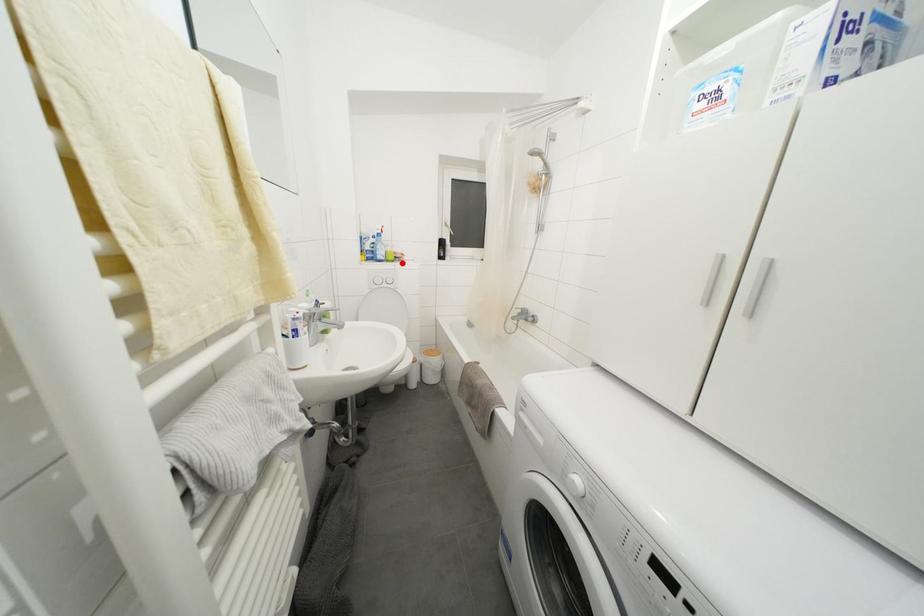
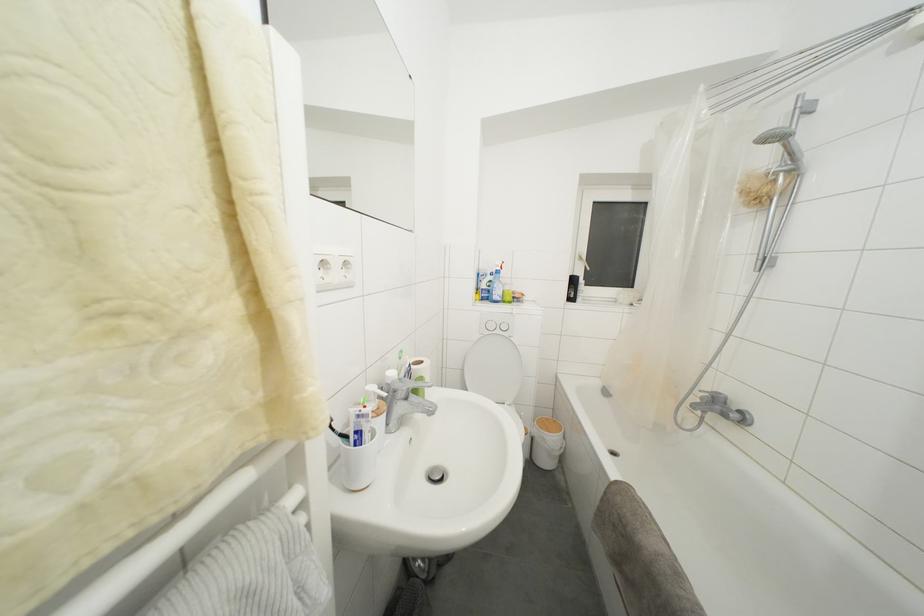
Question: I am providing you with two images of the same scene from different viewpoints. A red point is marked on the first image. Can you still see the location of the red point in image 2?

Choices:
 (A) Yes
 (B) No

Answer: (A)